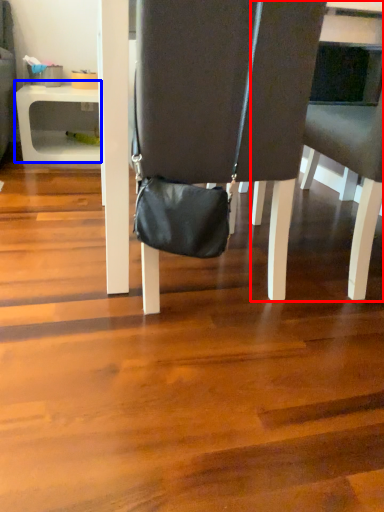
Question: Which of the following is the farthest to the observer, chair (highlighted by a red box) or table (highlighted by a blue box)?

Choices:
 (A) chair
 (B) table

Answer: (B)